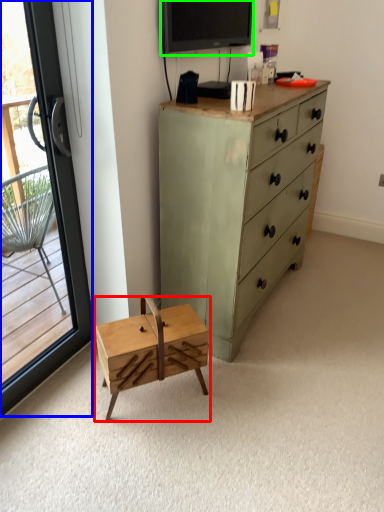
Question: Based on their relative distances, which object is farther from changing table (highlighted by a red box)? Choose from window (highlighted by a blue box) and television (highlighted by a green box).

Choices:
 (A) window
 (B) television

Answer: (B)